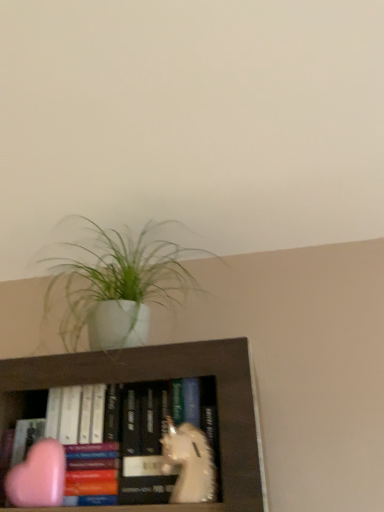
Question: Does pink matte heart at lower left, which is the second animal from right to left, have a lesser height compared to white matte pot at upper center?

Choices:
 (A) no
 (B) yes

Answer: (B)

Question: Is pink matte heart at lower left, positioned as the 1th animal in left-to-right order, completely or partially outside of white matte pot at upper center?

Choices:
 (A) no
 (B) yes

Answer: (B)

Question: Is pink matte heart at lower left, which is the second animal from right to left, to the right of white matte pot at upper center from the viewer's perspective?

Choices:
 (A) yes
 (B) no

Answer: (B)

Question: From the image's perspective, is pink matte heart at lower left, which is the second animal from right to left, over white matte pot at upper center?

Choices:
 (A) yes
 (B) no

Answer: (B)

Question: Is pink matte heart at lower left, which is the second animal from right to left, aimed at white matte pot at upper center?

Choices:
 (A) no
 (B) yes

Answer: (A)

Question: From the image's perspective, is pink matte heart at lower left, which is the second animal from right to left, under white matte pot at upper center?

Choices:
 (A) no
 (B) yes

Answer: (B)

Question: Is white matte unicorn at center, placed as the 1th animal when sorted from right to left, wider than white matte pot at upper center?

Choices:
 (A) yes
 (B) no

Answer: (B)

Question: From a real-world perspective, is white matte unicorn at center, placed as the 1th animal when sorted from right to left, physically below white matte pot at upper center?

Choices:
 (A) no
 (B) yes

Answer: (B)

Question: Can you confirm if white matte unicorn at center, placed as the 1th animal when sorted from right to left, is smaller than white matte pot at upper center?

Choices:
 (A) yes
 (B) no

Answer: (A)

Question: Does white matte unicorn at center, placed as the 1th animal when sorted from right to left, have a larger size compared to white matte pot at upper center?

Choices:
 (A) no
 (B) yes

Answer: (A)

Question: From the image's perspective, does white matte unicorn at center, the second animal viewed from the left, appear higher than white matte pot at upper center?

Choices:
 (A) yes
 (B) no

Answer: (B)

Question: From the image's perspective, is white matte unicorn at center, the second animal viewed from the left, beneath white matte pot at upper center?

Choices:
 (A) no
 (B) yes

Answer: (B)

Question: Is white matte pot at upper center outside pink matte heart at lower left, positioned as the 1th animal in left-to-right order?

Choices:
 (A) no
 (B) yes

Answer: (B)